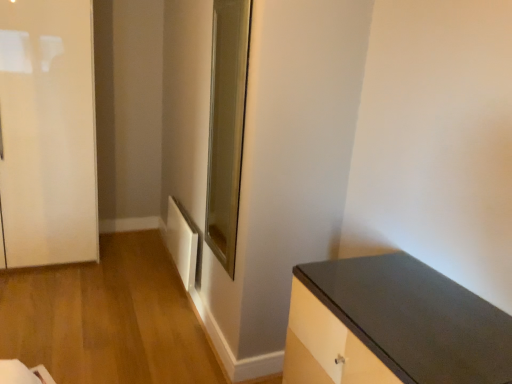
Question: Is white matte radiator at lower left at the back of clear glass door at center?

Choices:
 (A) yes
 (B) no

Answer: (B)

Question: Is white matte radiator at lower left completely or partially inside clear glass door at center?

Choices:
 (A) no
 (B) yes

Answer: (A)

Question: Can you confirm if clear glass door at center is wider than white matte radiator at lower left?

Choices:
 (A) no
 (B) yes

Answer: (B)

Question: Is clear glass door at center positioned far away from white matte radiator at lower left?

Choices:
 (A) no
 (B) yes

Answer: (A)

Question: Is clear glass door at center facing towards white matte radiator at lower left?

Choices:
 (A) yes
 (B) no

Answer: (B)

Question: Is clear glass door at center bigger than white matte radiator at lower left?

Choices:
 (A) no
 (B) yes

Answer: (B)

Question: Could white matte radiator at lower left be considered to be inside matte black countertop at lower right?

Choices:
 (A) yes
 (B) no

Answer: (B)

Question: Is matte black countertop at lower right closer to the viewer compared to white matte radiator at lower left?

Choices:
 (A) yes
 (B) no

Answer: (A)

Question: Is matte black countertop at lower right facing away from white matte radiator at lower left?

Choices:
 (A) yes
 (B) no

Answer: (B)

Question: Does matte black countertop at lower right come behind white matte radiator at lower left?

Choices:
 (A) yes
 (B) no

Answer: (B)

Question: Can you see matte black countertop at lower right touching white matte radiator at lower left?

Choices:
 (A) no
 (B) yes

Answer: (A)

Question: From a real-world perspective, is matte black countertop at lower right over white matte radiator at lower left?

Choices:
 (A) no
 (B) yes

Answer: (B)

Question: From the image's perspective, would you say clear glass door at center is shown under matte black countertop at lower right?

Choices:
 (A) yes
 (B) no

Answer: (B)